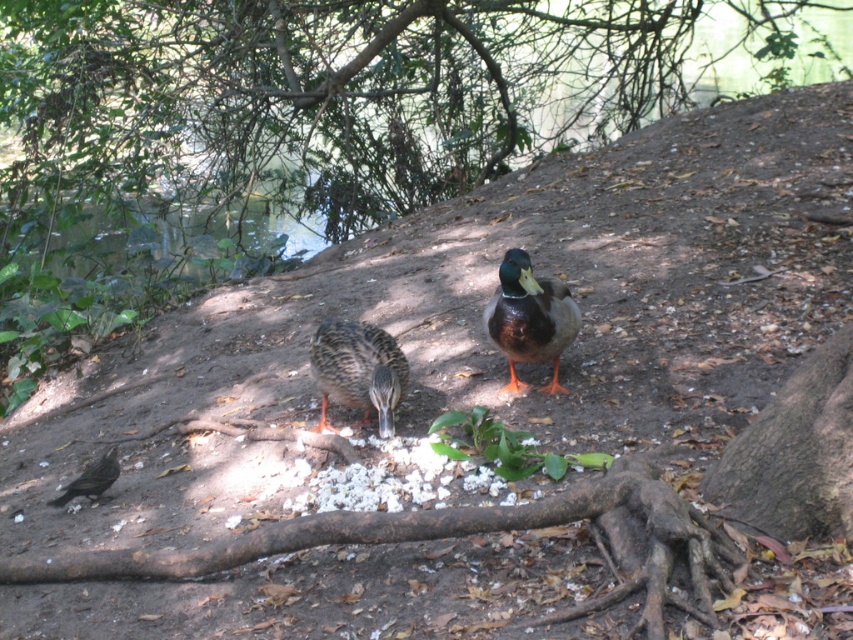
You are a birdwatcher observing two ducks on a dirt path. You notice the shiny brown duck at center and the brown speckled duck at center. Which duck has a slimmer body?

The shiny brown duck at center is thinner than the brown speckled duck at center, so it has a slimmer body.

You are a birdwatcher observing the two ducks on the dirt path. Which duck is closer to you, the shiny brown duck at center or the brown speckled duck at center?

The shiny brown duck at center is closer to you because the brown speckled duck at center is behind it.